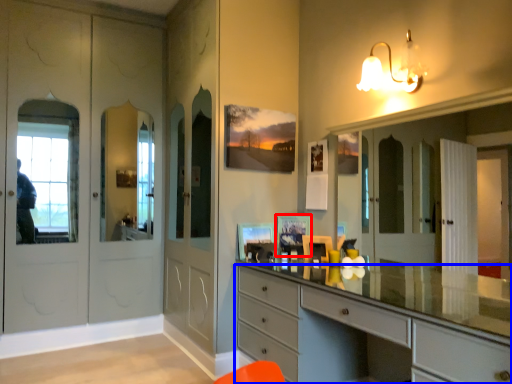
Question: Which object appears closest to the camera in this image, picture frame (highlighted by a red box) or chest of drawers (highlighted by a blue box)?

Choices:
 (A) picture frame
 (B) chest of drawers

Answer: (B)